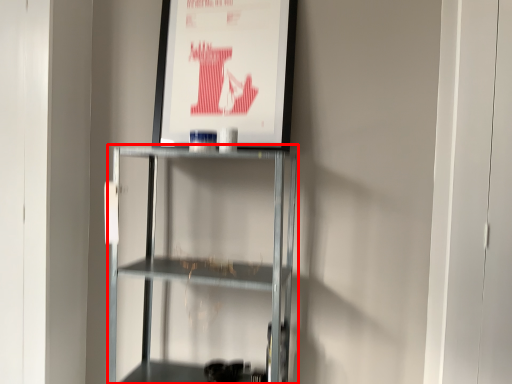
Question: From the image's perspective, where is shelf (annotated by the red box) located relative to poster page?

Choices:
 (A) above
 (B) below

Answer: (B)